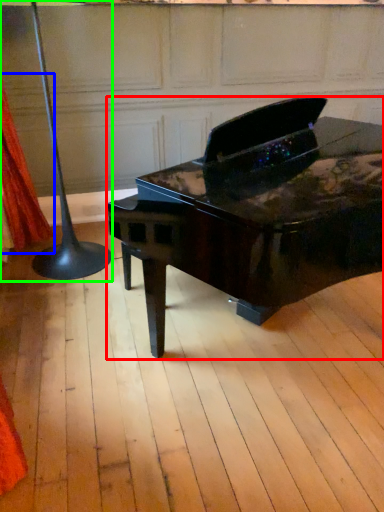
Question: Which object is the closest to the piano (highlighted by a red box)? Choose among these: curtain (highlighted by a blue box) or table lamp (highlighted by a green box).

Choices:
 (A) curtain
 (B) table lamp

Answer: (B)